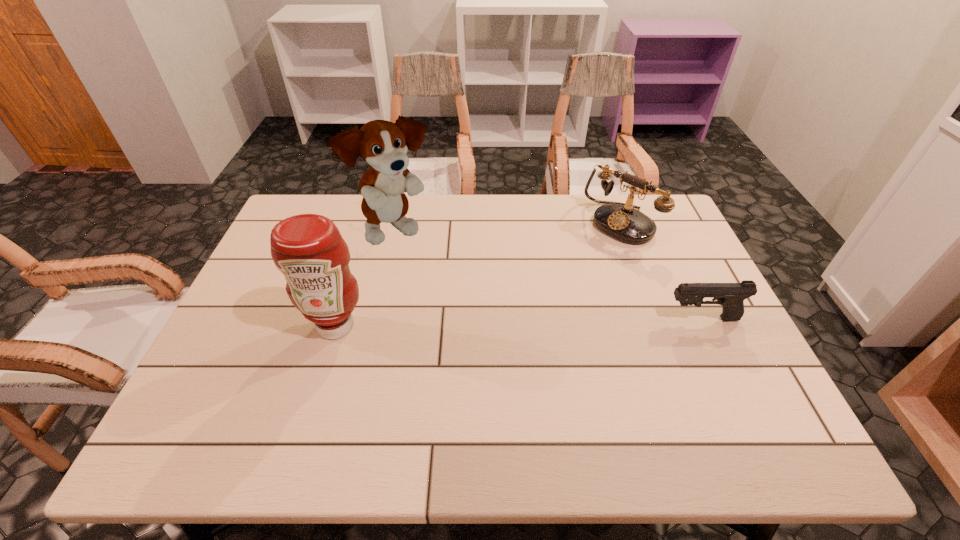
Find the location of a particular element. free area in between the puppy and the second shortest object is located at coordinates (509, 227).

The width and height of the screenshot is (960, 540). In order to click on free area in between the pistol and the condiment in this screenshot , I will do `click(518, 322)`.

Identify the location of free space between the tallest object and the pistol. This screenshot has width=960, height=540. (549, 275).

The image size is (960, 540). What are the coordinates of `vacant area that lies between the telephone and the condiment` in the screenshot? It's located at (478, 275).

The height and width of the screenshot is (540, 960). In order to click on the second closest object to the shortest object in this screenshot , I will do `click(382, 144)`.

Identify which object is the nearest to the tallest object. Please provide its 2D coordinates. Your answer should be formatted as a tuple, i.e. [(x, y)], where the tuple contains the x and y coordinates of a point satisfying the conditions above.

[(308, 249)]

Where is `blank area in the image that satisfies the following two spatial constraints: 1. on the back side of the tallest object; 2. on the left side of the telephone`? blank area in the image that satisfies the following two spatial constraints: 1. on the back side of the tallest object; 2. on the left side of the telephone is located at coordinates (398, 224).

Find the location of a particular element. free space that satisfies the following two spatial constraints: 1. on the back side of the shortest object; 2. at the barrel of the condiment is located at coordinates (338, 319).